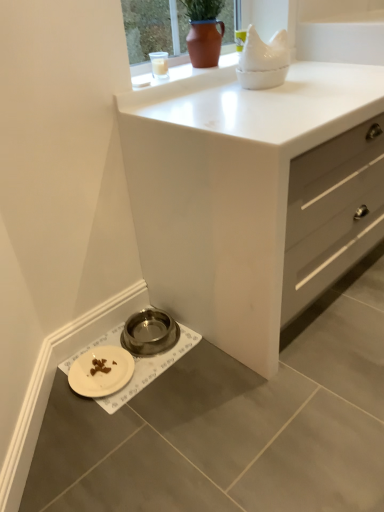
You are a GUI agent. You are given a task and a screenshot of the screen. Output one action in this format:
    pyautogui.click(x=<x>, y=<y>)
    Task: Click on the vacant space situated above white matte pet bowl at lower left (from a real-world perspective)
    The width and height of the screenshot is (384, 512).
    Given the screenshot: What is the action you would take?
    pyautogui.click(x=131, y=355)